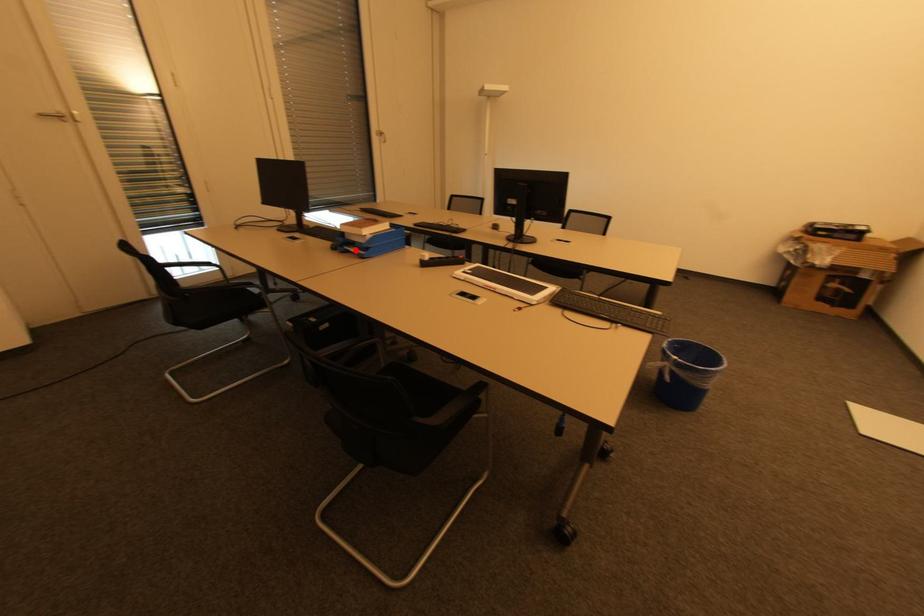
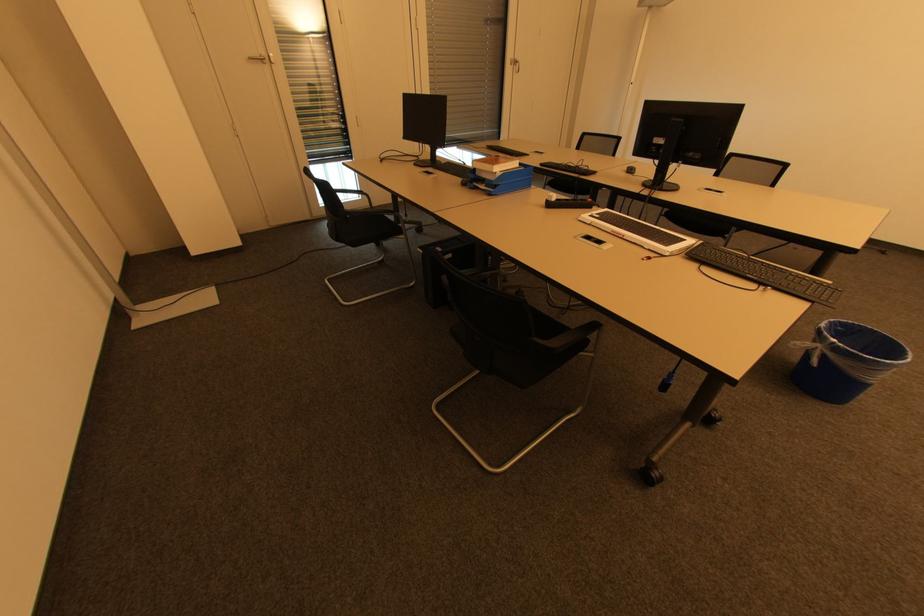
Find the pixel in the second image that matches the highlighted location in the first image.

(484, 187)